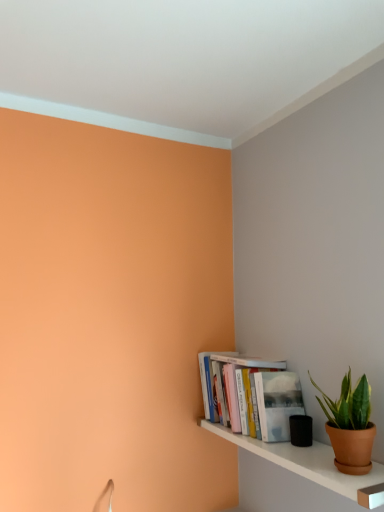
Question: Should I look upward or downward to see green matte plant pot at lower right?

Choices:
 (A) down
 (B) up

Answer: (A)

Question: Can you confirm if green matte plant pot at lower right is thinner than hardcover books at lower right?

Choices:
 (A) no
 (B) yes

Answer: (B)

Question: From the image's perspective, is green matte plant pot at lower right on hardcover books at lower right?

Choices:
 (A) yes
 (B) no

Answer: (A)

Question: Does green matte plant pot at lower right contain hardcover books at lower right?

Choices:
 (A) no
 (B) yes

Answer: (A)

Question: Does green matte plant pot at lower right have a lesser height compared to hardcover books at lower right?

Choices:
 (A) yes
 (B) no

Answer: (A)

Question: Is green matte plant pot at lower right smaller than hardcover books at lower right?

Choices:
 (A) yes
 (B) no

Answer: (A)

Question: Does green matte plant pot at lower right come behind hardcover books at lower right?

Choices:
 (A) no
 (B) yes

Answer: (A)

Question: From the image's perspective, is hardcover books at lower right located above green matte plant pot at lower right?

Choices:
 (A) no
 (B) yes

Answer: (A)

Question: Is hardcover books at lower right shorter than green matte plant pot at lower right?

Choices:
 (A) no
 (B) yes

Answer: (A)

Question: Is hardcover books at lower right outside green matte plant pot at lower right?

Choices:
 (A) yes
 (B) no

Answer: (A)

Question: Is hardcover books at lower right directly adjacent to green matte plant pot at lower right?

Choices:
 (A) no
 (B) yes

Answer: (A)

Question: Is green matte plant pot at lower right located within hardcover books at lower right?

Choices:
 (A) yes
 (B) no

Answer: (B)

Question: Is hardcover books at lower right closer to camera compared to green matte plant pot at lower right?

Choices:
 (A) no
 (B) yes

Answer: (A)

Question: From a real-world perspective, is green matte plant pot at lower right located higher than white glossy shelf at lower right?

Choices:
 (A) yes
 (B) no

Answer: (A)